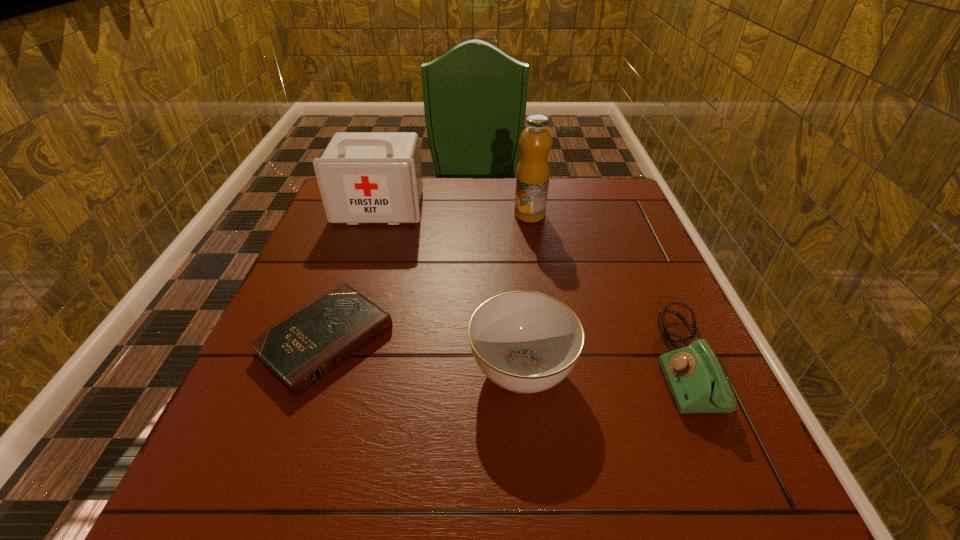
This screenshot has width=960, height=540. I want to click on vacant area at the near edge of the desktop, so click(567, 464).

Image resolution: width=960 pixels, height=540 pixels. I want to click on free space at the left edge, so click(x=335, y=264).

In the image, there is a desktop. Find the location of `vacant region at the right edge`. vacant region at the right edge is located at coordinates (698, 431).

In order to click on vacant space at the far right corner of the desktop in this screenshot , I will do `click(580, 192)`.

At what (x,y) coordinates should I click in order to perform the action: click on free space at the near right corner of the desktop. Please return your answer as a coordinate pair (x, y). The image size is (960, 540). Looking at the image, I should click on (755, 467).

The height and width of the screenshot is (540, 960). I want to click on free space between the first-aid kit and the tallest object, so click(x=455, y=211).

Find the location of `free space between the third shortest object and the Bible`. free space between the third shortest object and the Bible is located at coordinates (424, 355).

You are a GUI agent. You are given a task and a screenshot of the screen. Output one action in this format:
    pyautogui.click(x=<x>, y=<y>)
    Task: Click on the vacant area between the third tallest object and the second tallest object
    
    Given the screenshot: What is the action you would take?
    pyautogui.click(x=451, y=289)

Locate an element on the screen. The image size is (960, 540). free space that is in between the chinaware and the first-aid kit is located at coordinates (451, 289).

Identify the location of vacant area between the first-aid kit and the chinaware. click(451, 289).